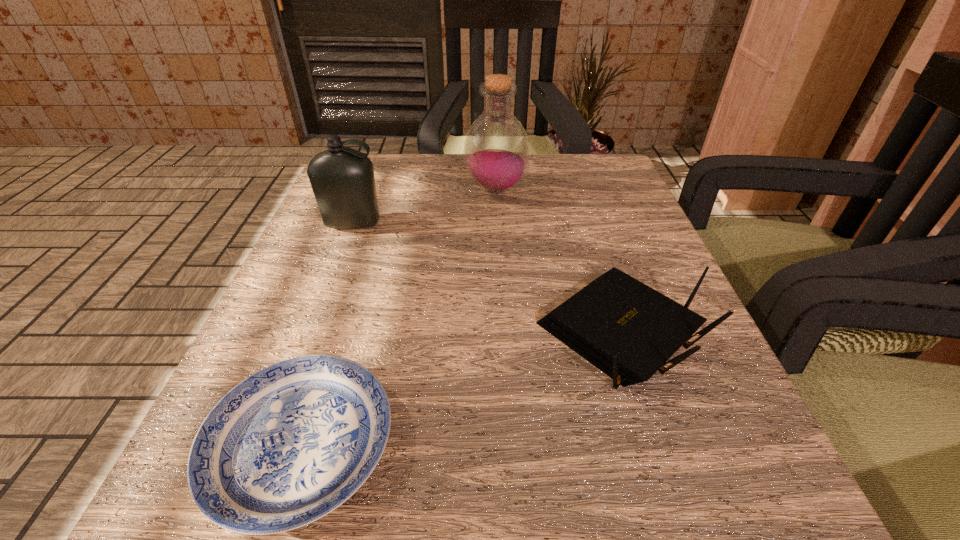
Find the location of a particular element. object at the right edge is located at coordinates (626, 329).

In order to click on free space at the far edge in this screenshot , I will do `click(516, 200)`.

Identify the location of vacant space at the near edge of the desktop. (399, 467).

Find the location of a particular element. The image size is (960, 540). blank space at the left edge is located at coordinates (337, 241).

The image size is (960, 540). In the image, there is a desktop. In order to click on vacant space at the right edge in this screenshot , I will do `click(588, 244)`.

Find the location of `vacant region at the far right corner of the desktop`. vacant region at the far right corner of the desktop is located at coordinates (580, 158).

This screenshot has width=960, height=540. In the image, there is a desktop. Identify the location of free space at the near right corner. (665, 485).

At what (x,y) coordinates should I click in order to perform the action: click on unoccupied area between the second shortest object and the third shortest object. Please return your answer as a coordinate pair (x, y). The height and width of the screenshot is (540, 960). Looking at the image, I should click on click(486, 278).

Find the location of a particular element. free space between the taller bottle and the third tallest object is located at coordinates (557, 261).

This screenshot has height=540, width=960. Identify the location of unoccupied area between the tallest object and the second tallest object. (424, 207).